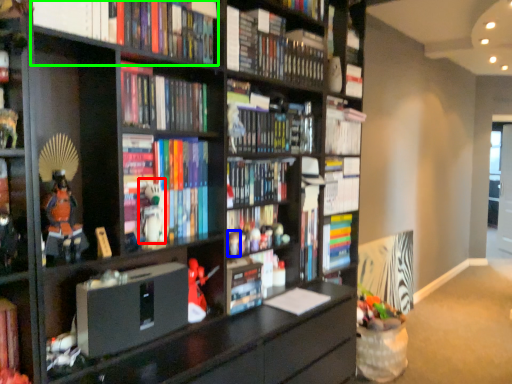
Question: Which object is the closest to the toy (highlighted by a red box)? Choose among these: toy (highlighted by a blue box) or book (highlighted by a green box).

Choices:
 (A) toy
 (B) book

Answer: (A)